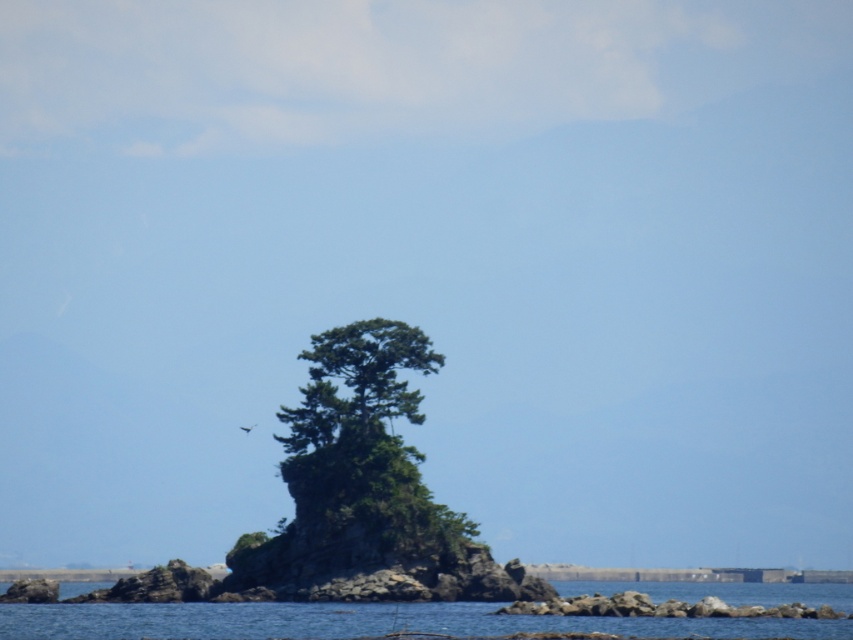
Question: Considering the relative positions of green leafy tree at center and blue water at center in the image provided, where is green leafy tree at center located with respect to blue water at center?

Choices:
 (A) left
 (B) right

Answer: (A)

Question: Does green leafy tree at center have a lesser width compared to blue water at center?

Choices:
 (A) yes
 (B) no

Answer: (A)

Question: Which point is closer to the camera taking this photo?

Choices:
 (A) (474, 609)
 (B) (457, 552)

Answer: (A)

Question: Which point is farther from the camera taking this photo?

Choices:
 (A) (474, 609)
 (B) (453, 525)

Answer: (B)

Question: Does green leafy tree at center have a larger size compared to blue water at center?

Choices:
 (A) no
 (B) yes

Answer: (A)